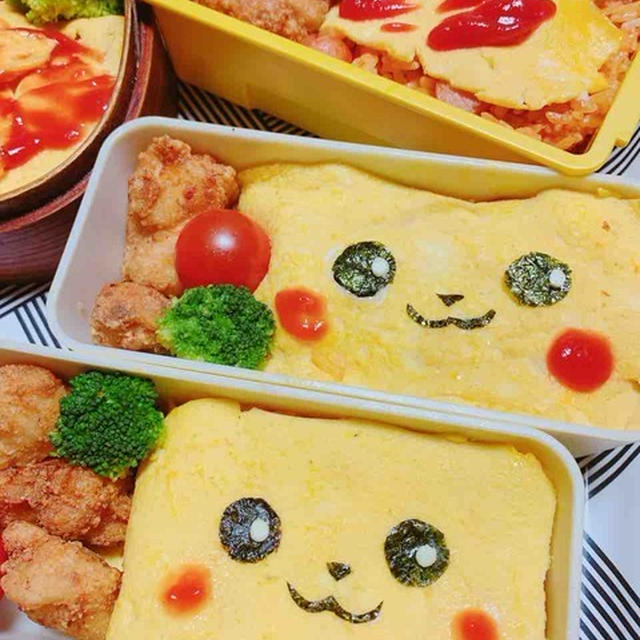
Locate an element on the screen. The width and height of the screenshot is (640, 640). wooden bowl is located at coordinates (33, 232).